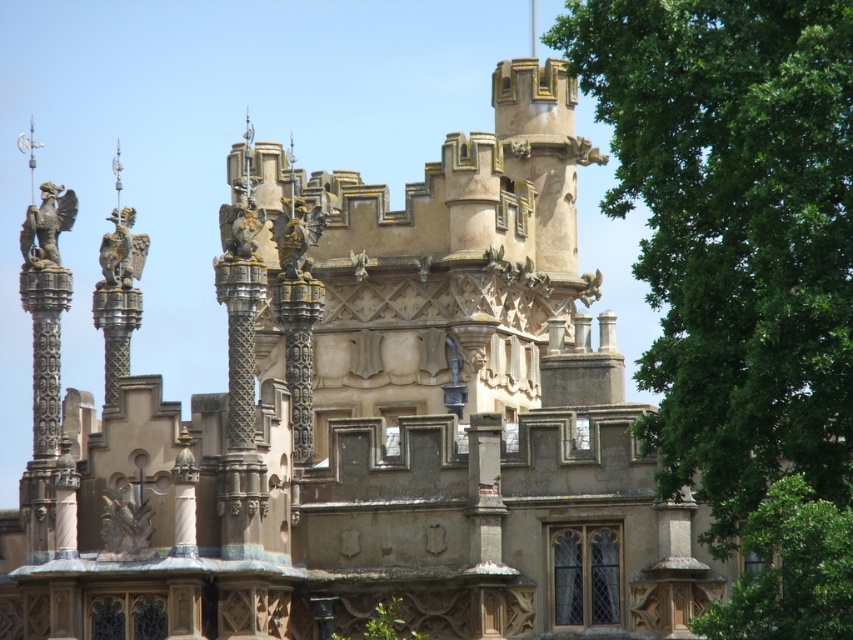
Question: Does green leafy tree at right appear on the right side of polished bronze statue at center?

Choices:
 (A) no
 (B) yes

Answer: (B)

Question: Which of the following is the closest to the observer?

Choices:
 (A) (129, 205)
 (B) (129, 547)
 (C) (317, 216)

Answer: (B)

Question: Which of these objects is positioned farthest from the green leafy tree at lower right?

Choices:
 (A) bronze/golden statue at center-left
 (B) polished bronze eagle at upper left
 (C) green leafy tree at right
 (D) polished bronze eagle at left

Answer: (D)

Question: Which of the following is the closest to the observer?

Choices:
 (A) (805, 492)
 (B) (49, 189)
 (C) (248, 230)

Answer: (A)

Question: Does bronze/golden statue at center-left appear on the right side of golden stone dragon at center?

Choices:
 (A) no
 (B) yes

Answer: (A)

Question: Is green leafy tree at lower right positioned behind polished bronze eagle at left?

Choices:
 (A) no
 (B) yes

Answer: (A)